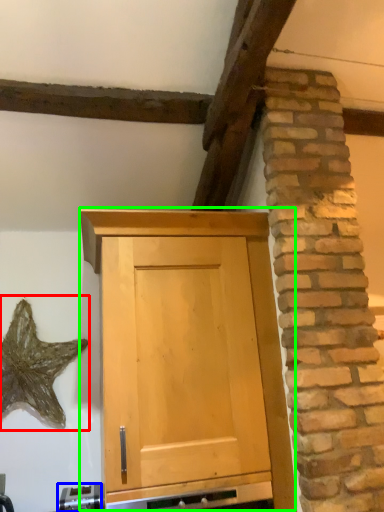
Question: Based on their relative distances, which object is nearer to star (highlighted by a red box)? Choose from appliance (highlighted by a blue box) and cupboard (highlighted by a green box).

Choices:
 (A) appliance
 (B) cupboard

Answer: (A)